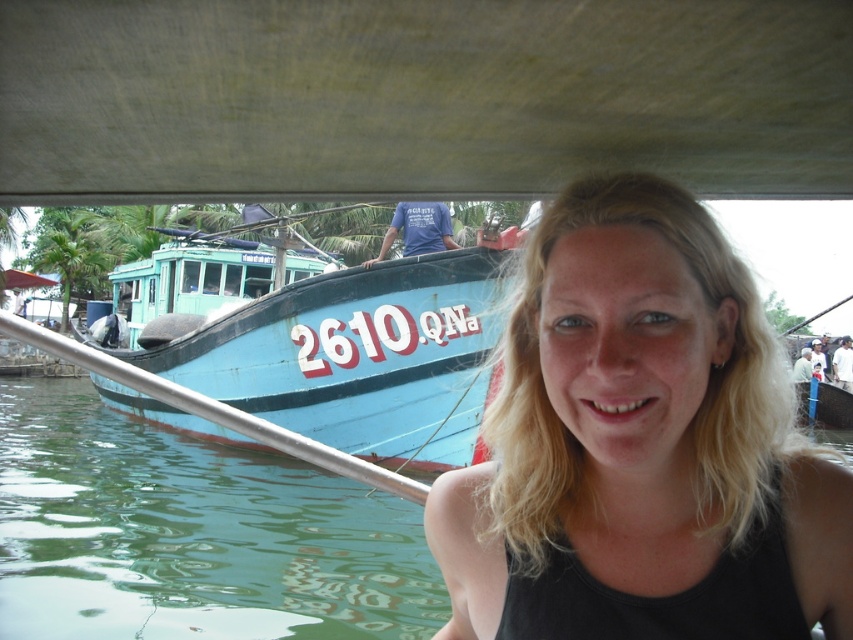
Who is taller, blonde hair at center or blue matte boat at left?

Standing taller between the two is blue matte boat at left.

Can you confirm if blonde hair at center is shorter than blue matte boat at left?

Yes, blonde hair at center is shorter than blue matte boat at left.

Between point (495, 616) and point (444, 307), which one is positioned in front?

Point (495, 616)

Identify the location of blonde hair at center. The width and height of the screenshot is (853, 640). (641, 445).